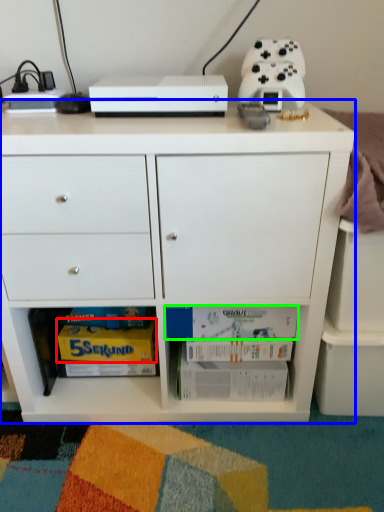
Question: Which object is the farthest from magazine (highlighted by a red box)? Choose among these: chest of drawers (highlighted by a blue box) or book (highlighted by a green box).

Choices:
 (A) chest of drawers
 (B) book

Answer: (A)